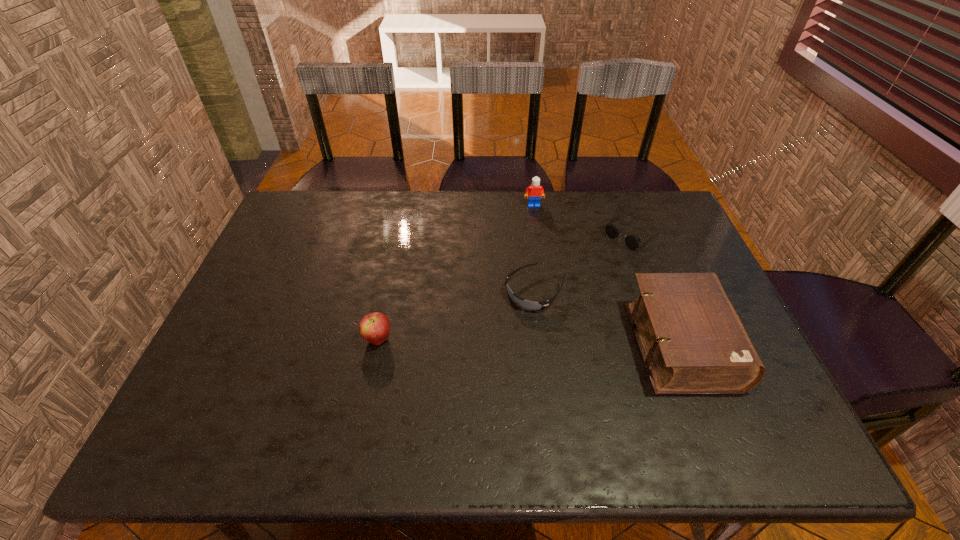
You are a GUI agent. You are given a task and a screenshot of the screen. Output one action in this format:
    pyautogui.click(x=<x>, y=<y>)
    Task: Click on the Bible that is at the right edge
    This screenshot has height=540, width=960.
    Given the screenshot: What is the action you would take?
    pyautogui.click(x=692, y=341)

Where is `sunglasses that is at the right edge`? sunglasses that is at the right edge is located at coordinates (632, 241).

The height and width of the screenshot is (540, 960). What are the coordinates of `object that is at the far right corner` in the screenshot? It's located at (632, 241).

I want to click on object present at the near right corner, so click(x=692, y=341).

In the image, there is a desktop. Identify the location of vacant space at the far edge. (582, 191).

Where is `vacant space at the left edge of the desktop`? vacant space at the left edge of the desktop is located at coordinates (265, 369).

In order to click on vacant area at the far left corner of the desktop in this screenshot , I will do `click(300, 232)`.

This screenshot has width=960, height=540. Identify the location of free space at the near left corner. (231, 405).

Find the location of a particular element. This screenshot has height=540, width=960. vacant space at the near right corner is located at coordinates (729, 398).

At what (x,y) coordinates should I click in order to perform the action: click on empty space between the left sunglasses and the apple. Please return your answer as a coordinate pair (x, y). Looking at the image, I should click on (456, 315).